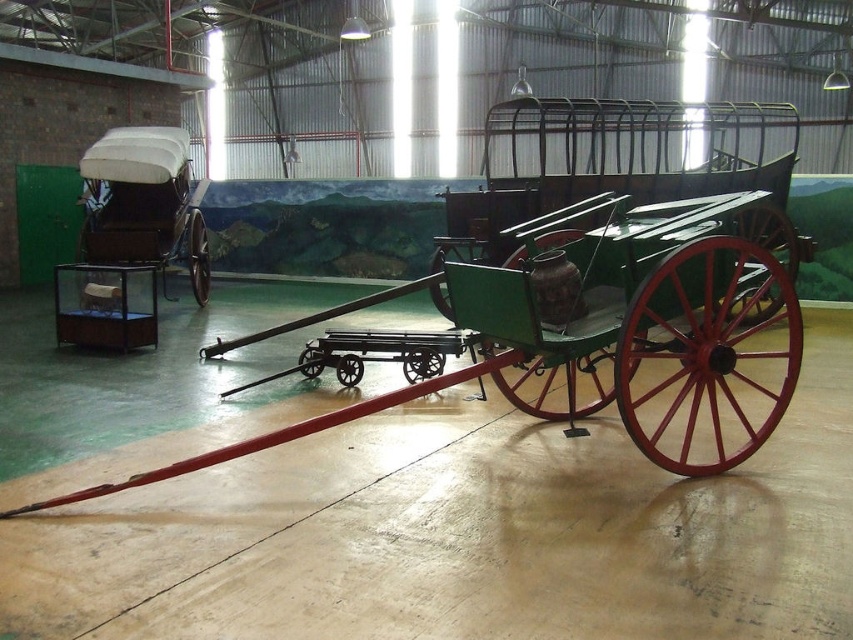
You are standing in the industrial building and want to place a new decorative item on the green polished wood horse cart at center. Can you place it there without it falling off the white fabric covered wagon at left?

The green polished wood horse cart at center is above the white fabric covered wagon at left, so placing the decorative item on the green polished wood horse cart at center would not affect the wagon below. However, ensure the item is secured to prevent it from falling off the cart itself.

You are planning to transport two items through a narrow corridor. The first item is the green polished wood horse cart at center, and the second is the white fabric covered wagon at left. Given the corridor is only wide enough for the narrower of the two, which one should you choose to fit through?

The white fabric covered wagon at left should be chosen because its width is smaller than the green polished wood horse cart at center, making it suitable for the narrow corridor.